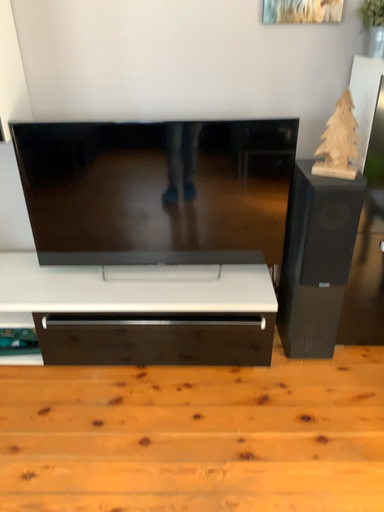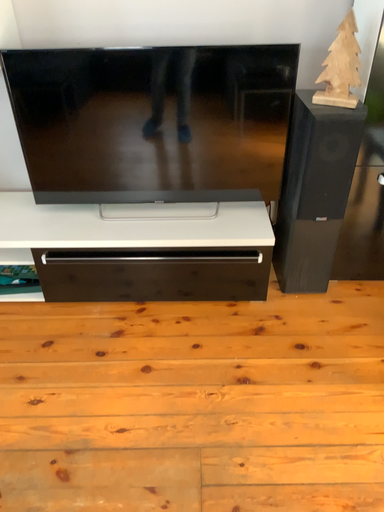
Question: Which way did the camera rotate in the video?

Choices:
 (A) rotated downward
 (B) rotated upward

Answer: (A)